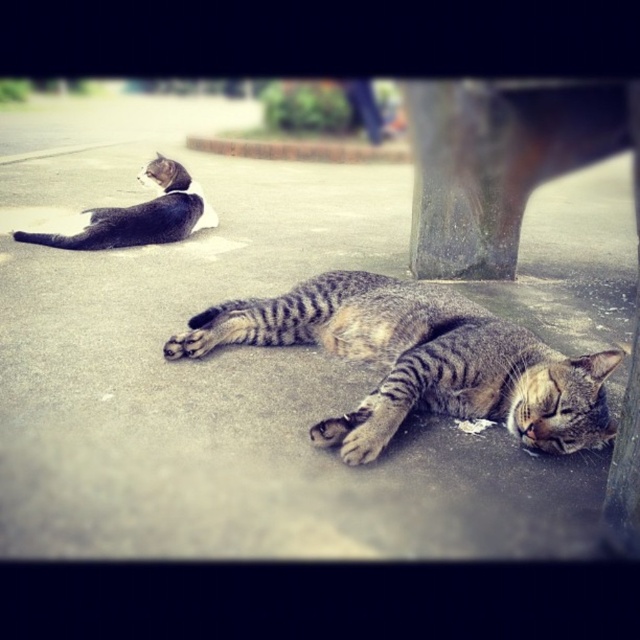
You are a photographer trying to capture both the gray concrete pavement at center and the striped fur cat at center in a single shot. Since you want the pavement to be the main focus, which object should you adjust your camera to prioritize in terms of depth of field?

The gray concrete pavement at center is closer to the viewer than the striped fur cat at center, so you should adjust your camera to prioritize the gray concrete pavement at center in terms of depth of field to keep it in focus while the background remains slightly blurred.

You are standing on the gray concrete pavement at center and want to reach the striped fur cat at center. Which direction should you move to get closer to the cat?

The gray concrete pavement at center is to the left of the striped fur cat at center, so you should move to the right to get closer to the striped fur cat at center.

You are a photographer standing 1.7 meters tall. You want to take a closeup photo of the gray concrete pavement at center. Can you reach it without bending down?

The gray concrete pavement at center is 1.53 meters from the camera. Since the photographer is 1.7 meters tall, they can easily reach it without bending down as the height is within comfortable reach.